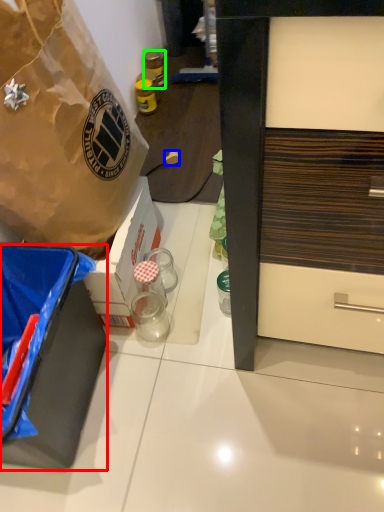
Question: Estimate the real-world distances between objects in this image. Which object is farther from box (highlighted by a red box), power outlet (highlighted by a blue box) or bottle (highlighted by a green box)?

Choices:
 (A) power outlet
 (B) bottle

Answer: (B)